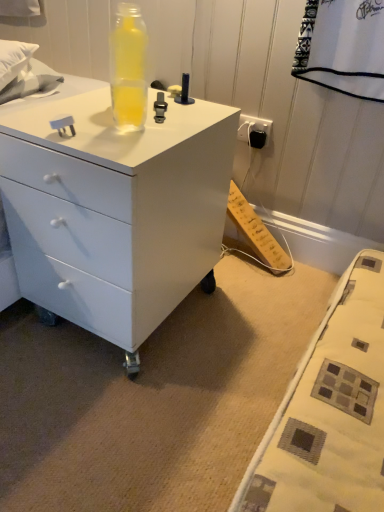
I want to click on free space in front of transparent plastic bottle at upper center, so click(124, 139).